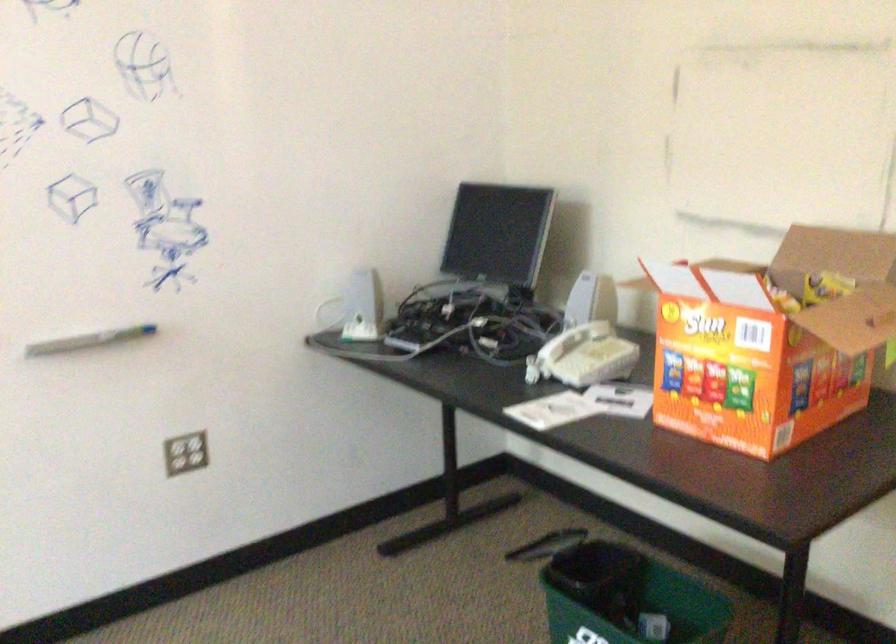
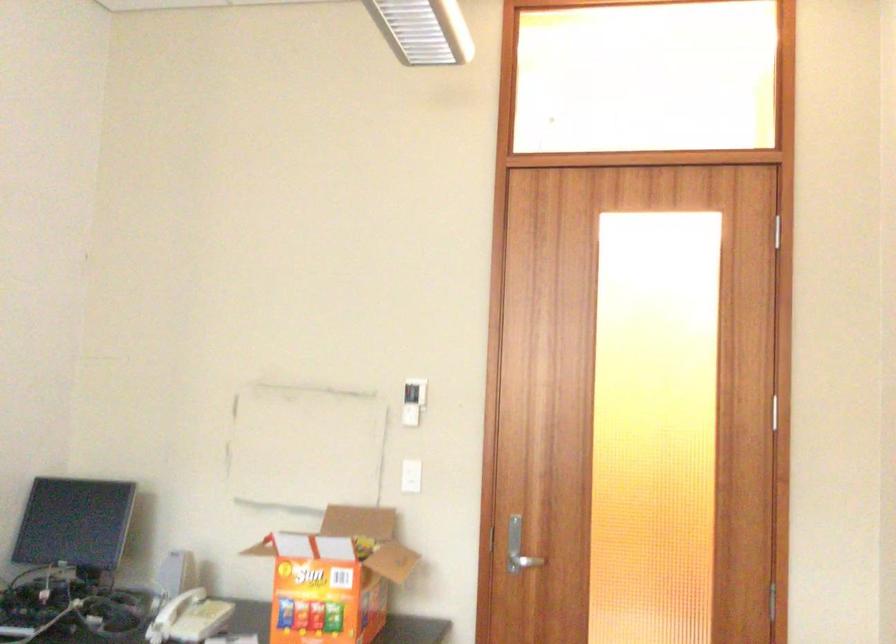
Locate, in the second image, the point that corresponds to (748,330) in the first image.

(334, 576)